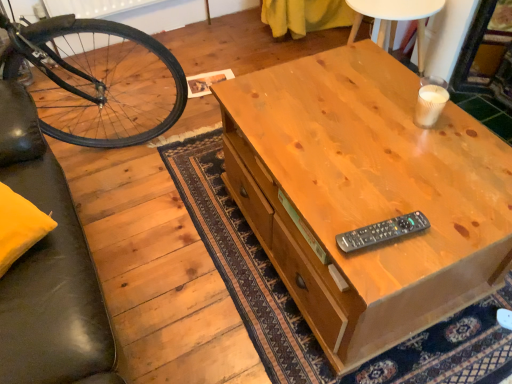
Locate an element on the screen. free space between black plastic remote at center and white paper cup at upper right is located at coordinates pyautogui.click(x=397, y=174).